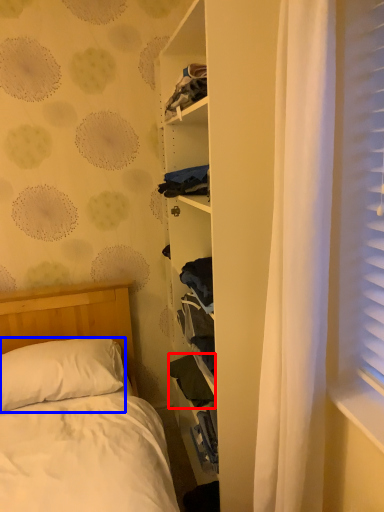
Question: Which object is closer to the camera taking this photo, clothing (highlighted by a red box) or pillow (highlighted by a blue box)?

Choices:
 (A) clothing
 (B) pillow

Answer: (B)